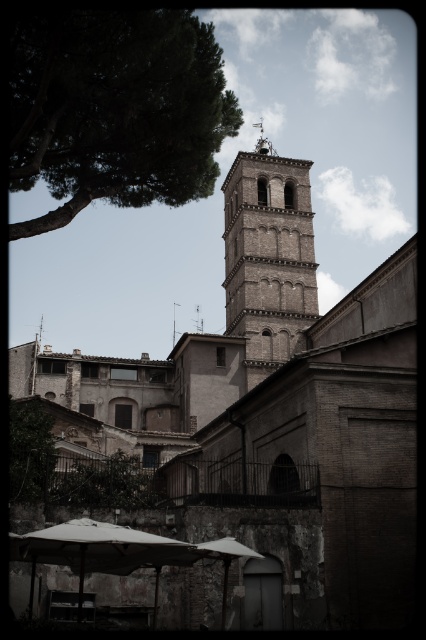
You are standing at the base of the bell tower and want to know what is located at the point with coordinates (115, 109). What is the object at that location?

The point at (115, 109) marks a green leafy tree at upper left.

You are standing at point A located at coordinates point A at (x=74, y=180). You want to walk to point B located at coordinates point B at 0.456, 0.321. The distance between them is 46.33 meters. Is this distance sufficient for you to comfortably walk from point A to point B without any obstacles?

The distance between point A at (x=74, y=180) and point B at 0.456, 0.321 is 46.33 meters. Since there are no obstacles mentioned in the scene description, you can comfortably walk this distance.

You are standing at the center of the image and want to locate the green leafy tree at upper left. According to the coordinates provided, in which direction should you look to find it?

The green leafy tree at upper left is located at coordinates point (115, 109), which is to the upper left direction from the center of the image.